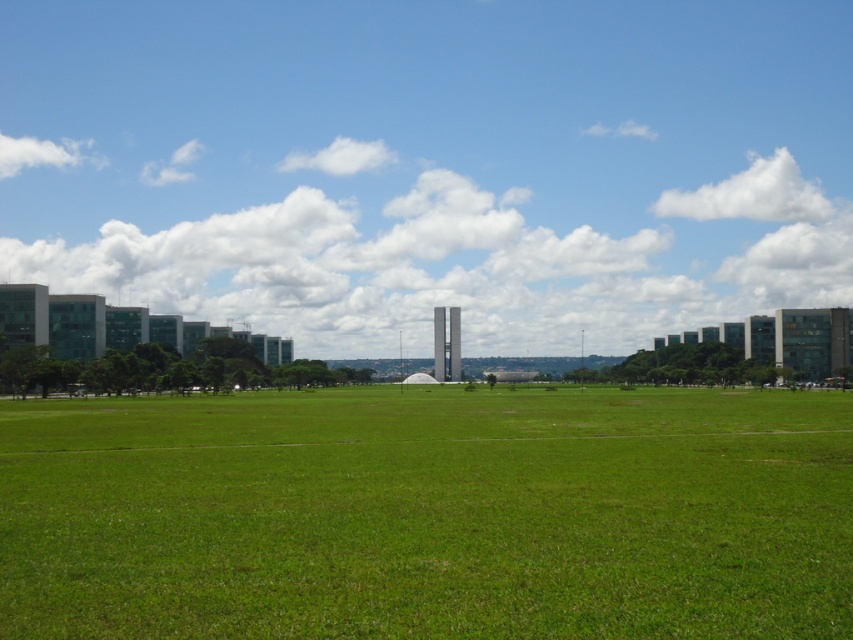
Question: Among these points, which one is farthest from the camera?

Choices:
 (A) (48, 93)
 (B) (346, 396)

Answer: (A)

Question: Is transparent glass buildings at center wider than green grass at center?

Choices:
 (A) yes
 (B) no

Answer: (A)

Question: Considering the relative positions of transparent glass buildings at center and green grass at center in the image provided, where is transparent glass buildings at center located with respect to green grass at center?

Choices:
 (A) above
 (B) below

Answer: (A)

Question: Which object is farther from the camera taking this photo?

Choices:
 (A) transparent glass buildings at center
 (B) green grass at center

Answer: (A)

Question: Which object appears closest to the camera in this image?

Choices:
 (A) transparent glass buildings at center
 (B) green grass at center

Answer: (B)

Question: Is transparent glass buildings at center thinner than green grass at center?

Choices:
 (A) no
 (B) yes

Answer: (A)